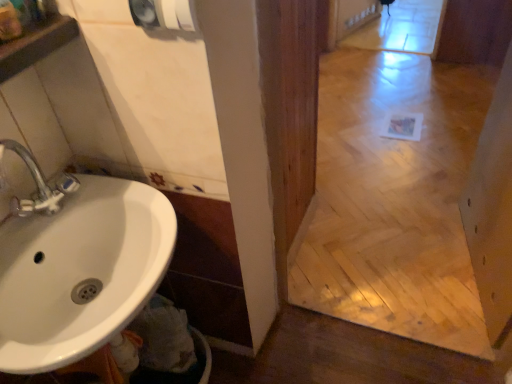
Measure the distance between matte gray hand dryer at upper center and camera.

matte gray hand dryer at upper center is 26.26 inches away from camera.

This screenshot has height=384, width=512. What do you see at coordinates (164, 14) in the screenshot?
I see `matte gray hand dryer at upper center` at bounding box center [164, 14].

Where is `matte gray hand dryer at upper center`? matte gray hand dryer at upper center is located at coordinates (164, 14).

This screenshot has height=384, width=512. What do you see at coordinates (78, 267) in the screenshot? I see `white glossy sink at lower left` at bounding box center [78, 267].

The width and height of the screenshot is (512, 384). I want to click on white glossy sink at lower left, so 78,267.

Locate an element on the screen. The width and height of the screenshot is (512, 384). matte gray hand dryer at upper center is located at coordinates (164, 14).

Considering the relative positions of white glossy sink at lower left and matte gray hand dryer at upper center in the image provided, is white glossy sink at lower left to the left of matte gray hand dryer at upper center from the viewer's perspective?

Yes.

Considering the positions of objects white glossy sink at lower left and matte gray hand dryer at upper center in the image provided, who is in front, white glossy sink at lower left or matte gray hand dryer at upper center?

white glossy sink at lower left.

Which is closer to the camera, (13, 242) or (180, 19)?

Clearly, point (13, 242) is more distant from the camera than point (180, 19).

From the image's perspective, is white glossy sink at lower left above or below matte gray hand dryer at upper center?

white glossy sink at lower left is situated lower than matte gray hand dryer at upper center in the image.

From a real-world perspective, which object stands above the other?

matte gray hand dryer at upper center, from a real-world perspective.

Does white glossy sink at lower left have a greater width compared to matte gray hand dryer at upper center?

Yes, white glossy sink at lower left is wider than matte gray hand dryer at upper center.

Which of these two, white glossy sink at lower left or matte gray hand dryer at upper center, stands taller?

white glossy sink at lower left.

Does white glossy sink at lower left have a larger size compared to matte gray hand dryer at upper center?

Indeed, white glossy sink at lower left has a larger size compared to matte gray hand dryer at upper center.

From the picture: Is white glossy sink at lower left not within matte gray hand dryer at upper center?

white glossy sink at lower left lies outside matte gray hand dryer at upper center's area.

Is white glossy sink at lower left next to matte gray hand dryer at upper center?

No, white glossy sink at lower left is not next to matte gray hand dryer at upper center.

Is white glossy sink at lower left facing away from matte gray hand dryer at upper center?

white glossy sink at lower left is not turned away from matte gray hand dryer at upper center.

What's the angular difference between white glossy sink at lower left and matte gray hand dryer at upper center's facing directions?

There is a 89.1-degree angle between the facing directions of white glossy sink at lower left and matte gray hand dryer at upper center.

Measure the distance from white glossy sink at lower left to matte gray hand dryer at upper center.

They are 48.03 centimeters apart.

The height and width of the screenshot is (384, 512). What are the coordinates of `sink on the left of matte gray hand dryer at upper center` in the screenshot? It's located at (78, 267).

In the image, is matte gray hand dryer at upper center on the left side or the right side of white glossy sink at lower left?

In the image, matte gray hand dryer at upper center appears on the right side of white glossy sink at lower left.

Is matte gray hand dryer at upper center closer to camera compared to white glossy sink at lower left?

No, matte gray hand dryer at upper center is further to the viewer.

Which is farther, [144,8] or [79,287]?

The point [79,287] is more distant.

From the image's perspective, is matte gray hand dryer at upper center above or below white glossy sink at lower left?

matte gray hand dryer at upper center is situated higher than white glossy sink at lower left in the image.

From a real-world perspective, is matte gray hand dryer at upper center under white glossy sink at lower left?

No, from a real-world perspective, matte gray hand dryer at upper center is not below white glossy sink at lower left.

Is matte gray hand dryer at upper center wider or thinner than white glossy sink at lower left?

Considering their sizes, matte gray hand dryer at upper center looks slimmer than white glossy sink at lower left.

In the scene shown: Which of these two, matte gray hand dryer at upper center or white glossy sink at lower left, stands shorter?

Standing shorter between the two is matte gray hand dryer at upper center.

Looking at this image, considering the sizes of objects matte gray hand dryer at upper center and white glossy sink at lower left in the image provided, who is bigger, matte gray hand dryer at upper center or white glossy sink at lower left?

white glossy sink at lower left.

Looking at this image, could white glossy sink at lower left be considered to be inside matte gray hand dryer at upper center?

Definitely not — white glossy sink at lower left is not inside matte gray hand dryer at upper center.

Are matte gray hand dryer at upper center and white glossy sink at lower left beside each other?

No, matte gray hand dryer at upper center is not touching white glossy sink at lower left.

Does matte gray hand dryer at upper center turn towards white glossy sink at lower left?

No, matte gray hand dryer at upper center does not turn towards white glossy sink at lower left.

How many degrees apart are the facing directions of matte gray hand dryer at upper center and white glossy sink at lower left?

89.1 degrees.

Measure the distance from matte gray hand dryer at upper center to white glossy sink at lower left.

They are 18.91 inches apart.

Find the location of a particular element. This screenshot has width=512, height=384. sink located on the left of matte gray hand dryer at upper center is located at coordinates (78, 267).

Find the location of a particular element. The image size is (512, 384). hand dryer above the white glossy sink at lower left (from a real-world perspective) is located at coordinates (164, 14).

At what (x,y) coordinates should I click in order to perform the action: click on sink below the matte gray hand dryer at upper center (from a real-world perspective). Please return your answer as a coordinate pair (x, y). This screenshot has width=512, height=384. Looking at the image, I should click on (78, 267).